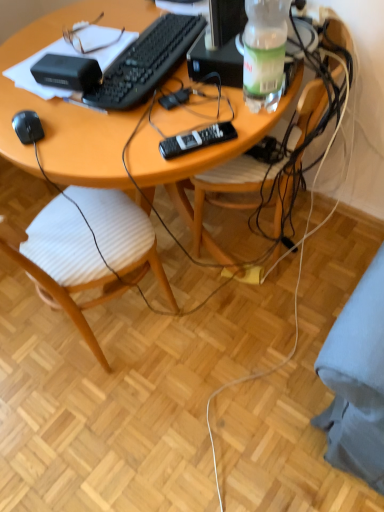
Locate an element on the screen. The height and width of the screenshot is (512, 384). vacant space situated on the left part of brown plastic glasses at upper left is located at coordinates (39, 54).